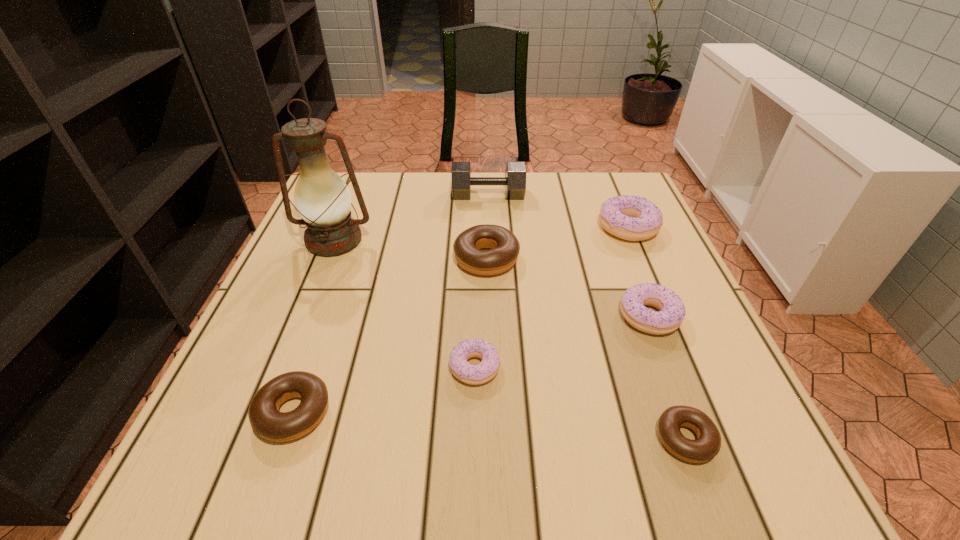
Find the location of a particular element. This screenshot has height=540, width=960. the tallest object is located at coordinates (322, 198).

The height and width of the screenshot is (540, 960). I want to click on the farthest object, so click(x=515, y=180).

In order to click on the second tallest object in this screenshot , I will do `click(515, 180)`.

Where is `the biggest purple doughnut`? the biggest purple doughnut is located at coordinates (633, 218).

I want to click on the farthest brown doughnut, so click(x=505, y=247).

The width and height of the screenshot is (960, 540). Find the location of `the second brown doughnut from left to right`. the second brown doughnut from left to right is located at coordinates (505, 247).

The image size is (960, 540). Find the location of `the fourth nearest doughnut`. the fourth nearest doughnut is located at coordinates (672, 311).

Where is `the second smallest purple doughnut`? This screenshot has width=960, height=540. the second smallest purple doughnut is located at coordinates (672, 311).

Where is `the leftmost brown doughnut`? the leftmost brown doughnut is located at coordinates (265, 419).

Find the location of a particular element. the leftmost doughnut is located at coordinates (265, 419).